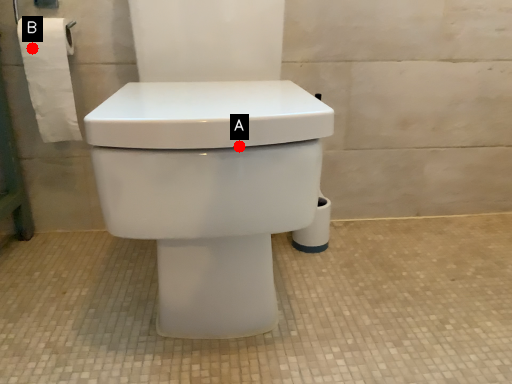
Question: Two points are circled on the image, labeled by A and B beside each circle. Which point is closer to the camera taking this photo?

Choices:
 (A) A is closer
 (B) B is closer

Answer: (A)